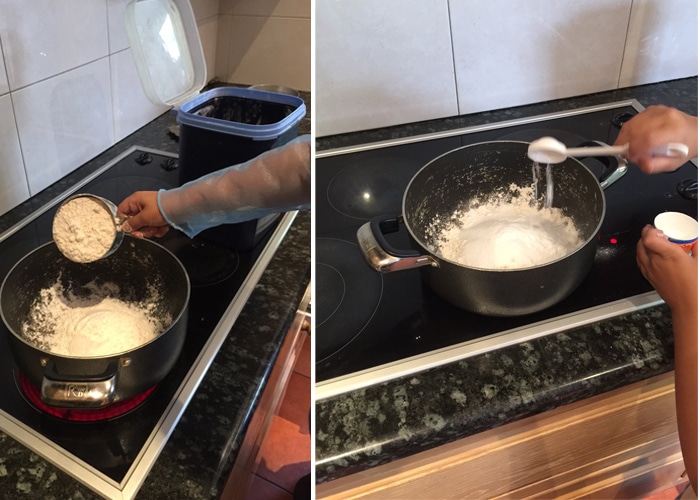
Identify the location of pot. This screenshot has width=700, height=500. (550, 278).